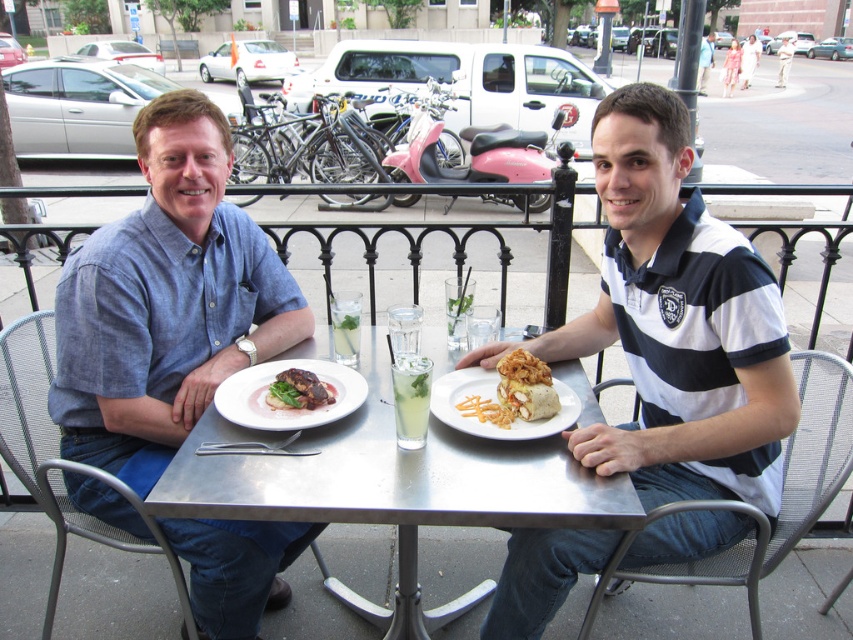
Question: Which point appears farthest from the camera in this image?

Choices:
 (A) (653, 394)
 (B) (303, 371)
 (C) (428, 396)

Answer: (A)

Question: Which of the following is the closest to the observer?

Choices:
 (A) clear glass at table center
 (B) white striped polo shirt at center
 (C) blue cotton shirt at left
 (D) clear glass at center

Answer: (B)

Question: Is matte brown steak at center smaller than clear glass at table center?

Choices:
 (A) no
 (B) yes

Answer: (B)

Question: Is blue cotton shirt at left closer to the viewer compared to metallic silver table at center?

Choices:
 (A) no
 (B) yes

Answer: (A)

Question: Where is metallic silver table at center located in relation to golden crispy fries at center in the image?

Choices:
 (A) above
 (B) below

Answer: (B)

Question: Which of the following is the farthest from the observer?

Choices:
 (A) (339, 339)
 (B) (399, 449)
 (C) (722, 86)
 (D) (412, 419)

Answer: (C)